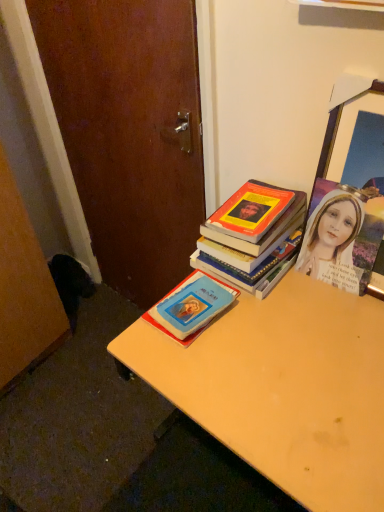
I want to click on vacant area that is in front of blue matte book at center, the first book ordered from the bottom, so click(216, 375).